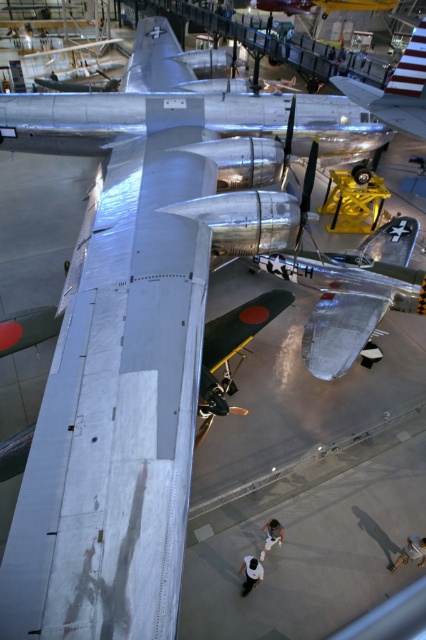
You are a museum visitor standing in front of the silver metallic airplane at upper center and the white matte shirt at center. Which object is bigger?

The silver metallic airplane at upper center is larger in size than the white matte shirt at center.

You are a visitor at the aviation museum and want to take a photo of the polished silver airplane at center and the white matte shirt at center. Which object should you focus on first to ensure both are in the frame?

The polished silver airplane at center is positioned on the right side of white matte shirt at center, so you should focus on the white matte shirt at center first to ensure both are in the frame.